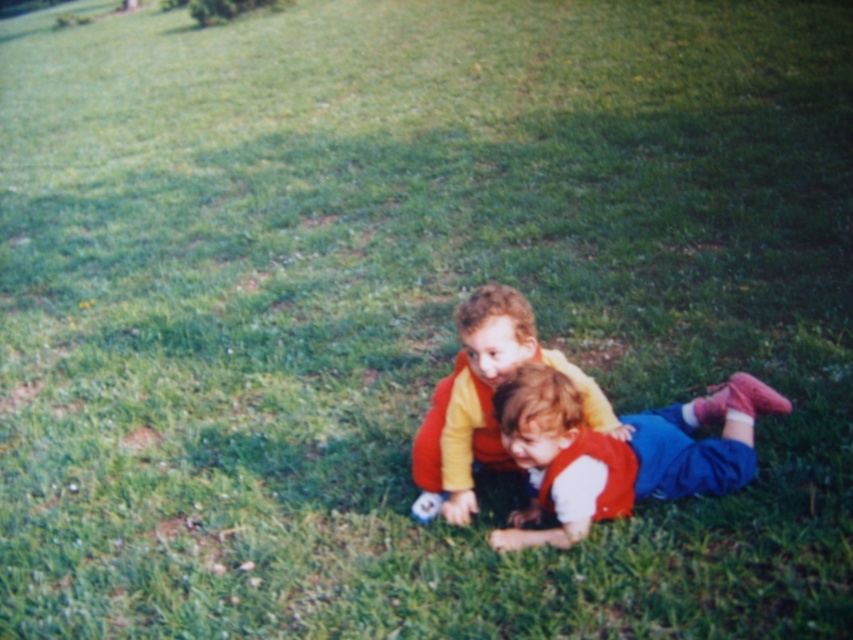
You are standing at the point marked by coordinates (619, 452) in the image. Looking around, you see the matte red vest at center. Which direction should you face to see the child wearing a yellow top with orange sleeves?

The matte red vest at center is located at point (619, 452). Since the child wearing a yellow top with orange sleeves is positioned slightly behind and to the left of the foreground child, you should face towards the left and behind the matte red vest at center to see them.

You are a parent trying to identify which of your children is wearing the larger clothing item. You see the matte red vest at center and the matte yellow shirt at center. Which clothing item is bigger?

The matte red vest at center is larger than the matte yellow shirt at center.

You are a photographer trying to capture both children in a single shot. Since the matte red vest at center and the matte yellow shirt at center are at different distances, which one should you focus on first to ensure both are in focus?

You should focus on the matte red vest at center first because it is closer to the viewer than the matte yellow shirt at center, ensuring the foreground and background are sharp.